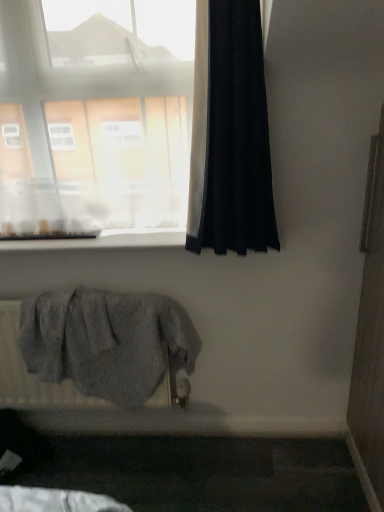
Question: Relative to black fabric curtain at right, is transparent glass window at upper left in front or behind?

Choices:
 (A) behind
 (B) front

Answer: (A)

Question: Is transparent glass window at upper left inside the boundaries of black fabric curtain at right, or outside?

Choices:
 (A) outside
 (B) inside

Answer: (A)

Question: Estimate the real-world distances between objects in this image. Which object is closer to the transparent glass window at upper left?

Choices:
 (A) gray fabric radiator at lower left
 (B) black fabric curtain at right
 (C) white smooth window sill at upper center

Answer: (B)

Question: Estimate the real-world distances between objects in this image. Which object is closer to the white smooth window sill at upper center?

Choices:
 (A) transparent glass window at upper left
 (B) gray fabric radiator at lower left
 (C) black fabric curtain at right

Answer: (A)